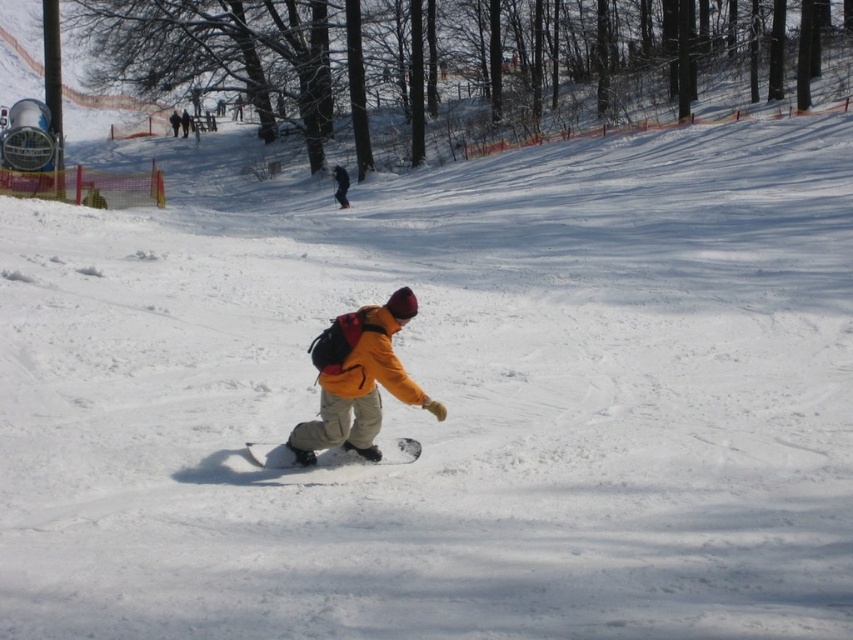
Question: Which object is positioned farthest from the brown wood tree at upper center?

Choices:
 (A) white matte snowboard at center
 (B) matte yellow jacket at center

Answer: (B)

Question: Is matte yellow jacket at center to the right of white matte snowboard at center from the viewer's perspective?

Choices:
 (A) yes
 (B) no

Answer: (A)

Question: Considering the real-world distances, which object is closest to the white matte snowboard at center?

Choices:
 (A) yellow matte jacket at center
 (B) matte yellow jacket at center

Answer: (B)

Question: Considering the relative positions of matte yellow jacket at center and white matte snowboard at center in the image provided, where is matte yellow jacket at center located with respect to white matte snowboard at center?

Choices:
 (A) right
 (B) left

Answer: (A)

Question: Can you confirm if matte yellow jacket at center is bigger than yellow matte jacket at center?

Choices:
 (A) no
 (B) yes

Answer: (A)

Question: Which point appears closest to the camera in this image?

Choices:
 (A) (352, 433)
 (B) (340, 205)
 (C) (540, 88)
 (D) (251, 454)

Answer: (A)